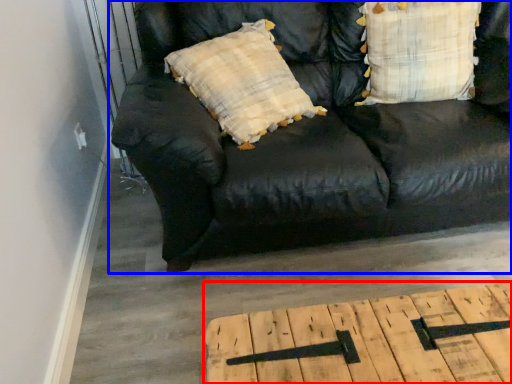
Question: Which of the following is the closest to the observer, table (highlighted by a red box) or studio couch (highlighted by a blue box)?

Choices:
 (A) table
 (B) studio couch

Answer: (A)